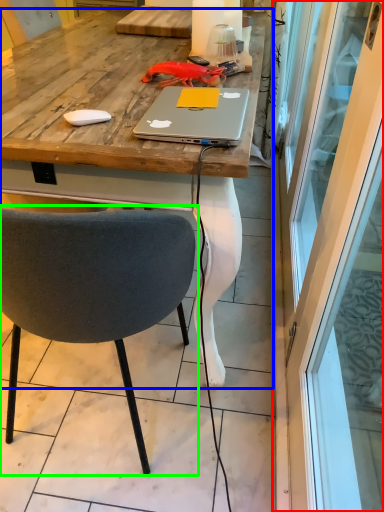
Question: Considering the real-world distances, which object is closest to screen door (highlighted by a red box)? desk (highlighted by a blue box) or chair (highlighted by a green box).

Choices:
 (A) desk
 (B) chair

Answer: (A)